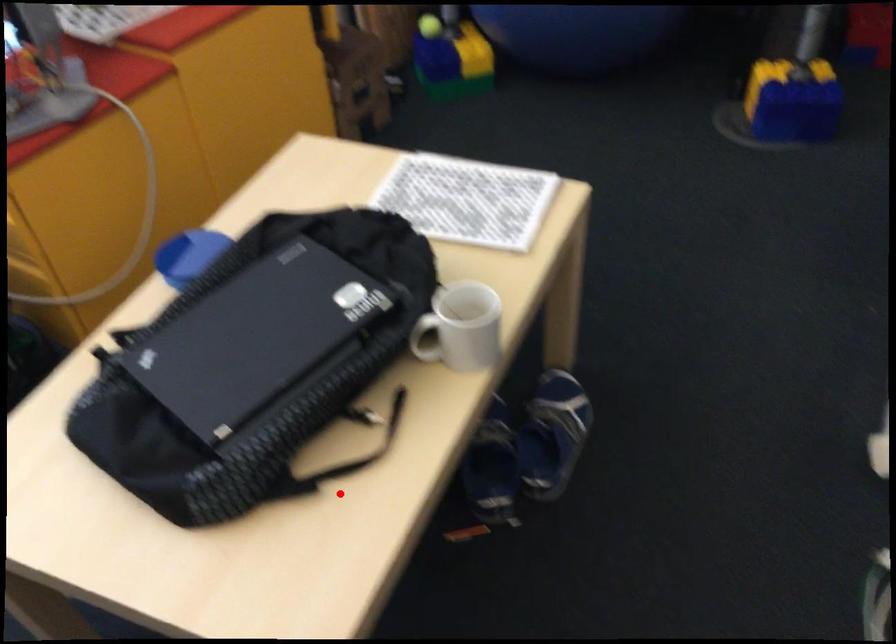
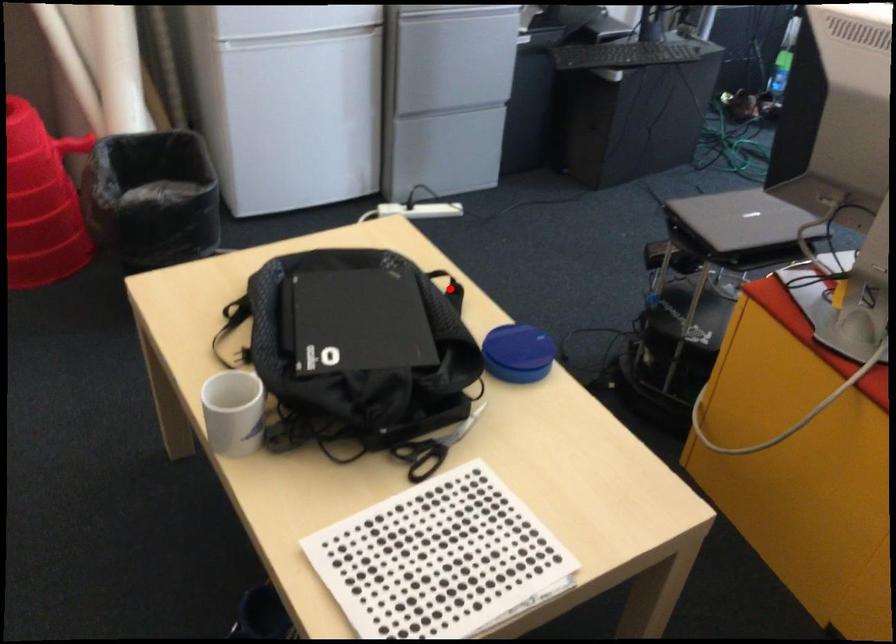
I am providing you with two images of the same scene from different viewpoints. A red point is marked on the first image and another point is marked on the second image. Is the marked point in image1 the same physical position as the marked point in image2?

No